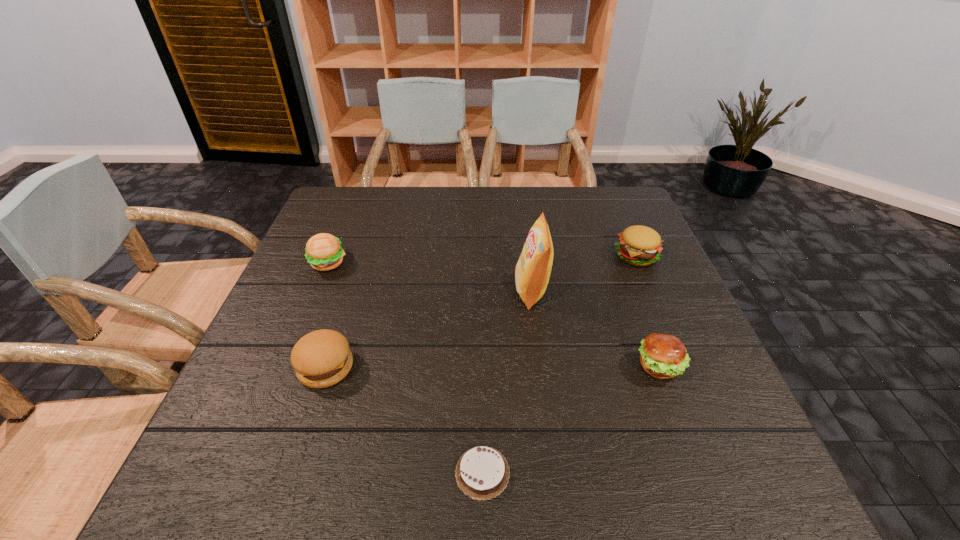
The width and height of the screenshot is (960, 540). In order to click on vacant region at the near edge in this screenshot , I will do `click(376, 496)`.

Where is `vacant space at the left edge`? vacant space at the left edge is located at coordinates (351, 254).

This screenshot has width=960, height=540. In order to click on vacant region at the right edge of the desktop in this screenshot , I will do `click(671, 392)`.

Identify the location of vacant space at the far left corner of the desktop. This screenshot has height=540, width=960. (348, 207).

Find the location of a particular element. free location at the near left corner of the desktop is located at coordinates (259, 469).

Where is `vacant space at the far right corner of the desktop`? The width and height of the screenshot is (960, 540). vacant space at the far right corner of the desktop is located at coordinates (598, 221).

Identify the location of empty space between the third object from left to right and the crisp (potato chip). (507, 381).

At what (x,y) coordinates should I click in order to perform the action: click on vacant region between the tallest object and the nearest object. Please return your answer as a coordinate pair (x, y). This screenshot has width=960, height=540. Looking at the image, I should click on (507, 381).

Locate which object ranks fifth in proximity to the chocolate cake. Please provide its 2D coordinates. Your answer should be formatted as a tuple, i.e. [(x, y)], where the tuple contains the x and y coordinates of a point satisfying the conditions above.

[(639, 245)]

Locate which object ranks fourth in proximity to the nearest object. Please provide its 2D coordinates. Your answer should be formatted as a tuple, i.e. [(x, y)], where the tuple contains the x and y coordinates of a point satisfying the conditions above.

[(324, 252)]